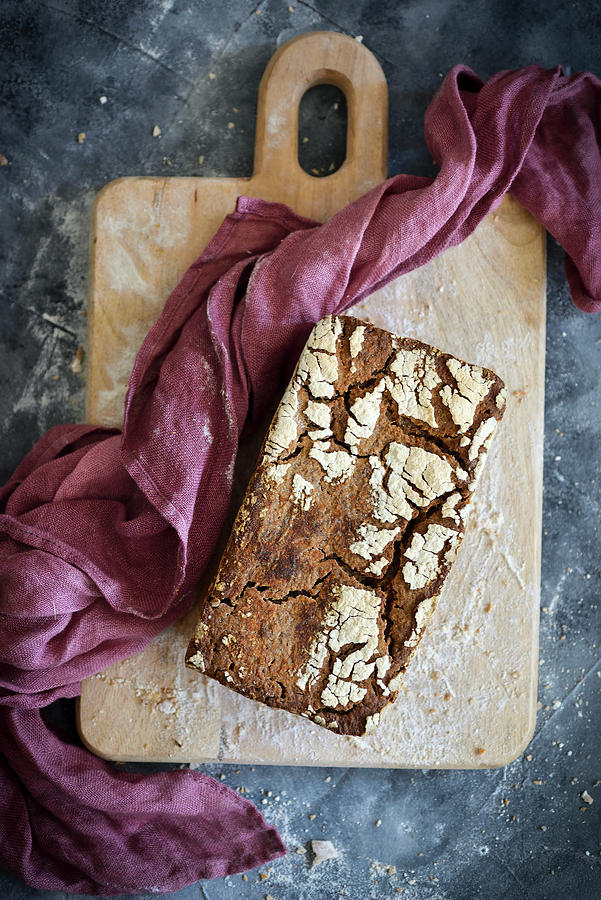
The image size is (601, 900). In order to click on table in this screenshot , I will do `click(172, 69)`.